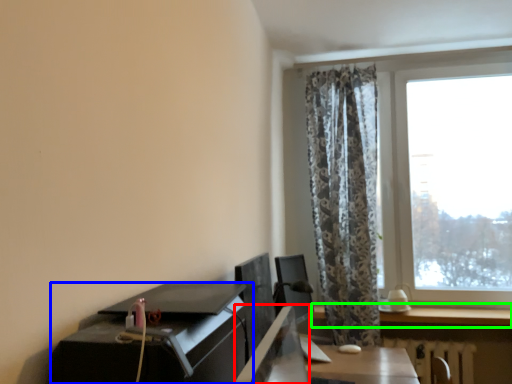
Question: Based on their relative distances, which object is nearer to desktop (highlighted by a red box)? Choose from desk (highlighted by a blue box) and window (highlighted by a green box).

Choices:
 (A) desk
 (B) window

Answer: (A)